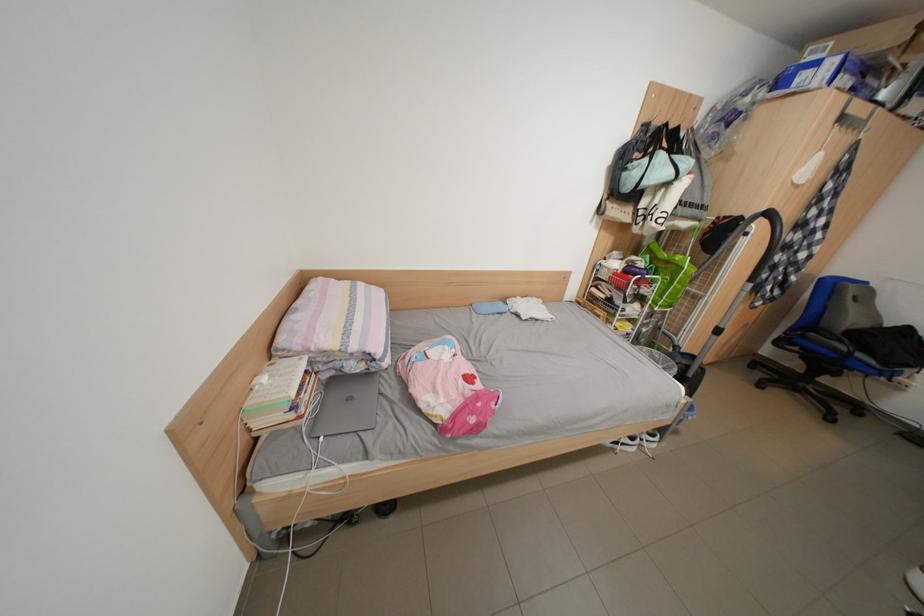
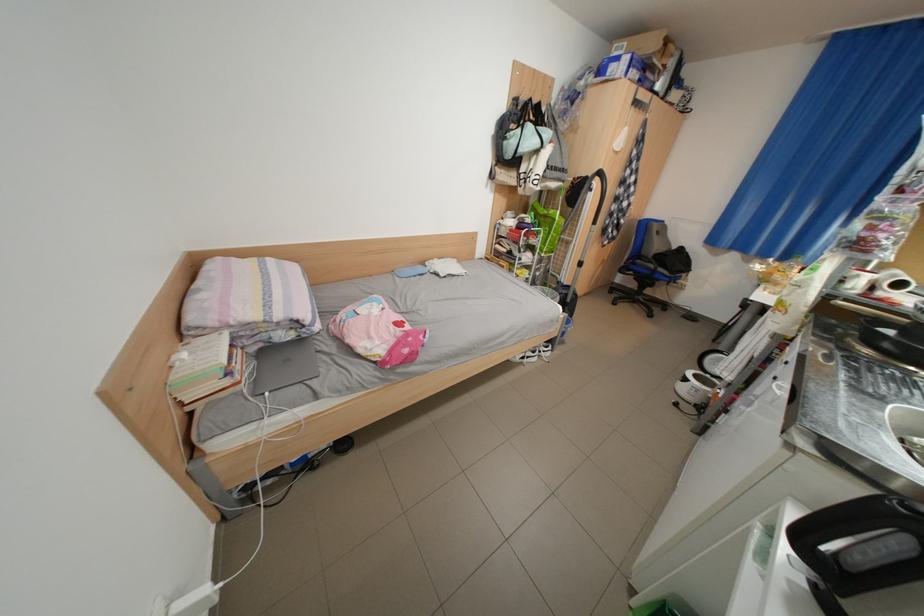
Locate, in the second image, the point that corresponds to (815,338) in the first image.

(646, 265)